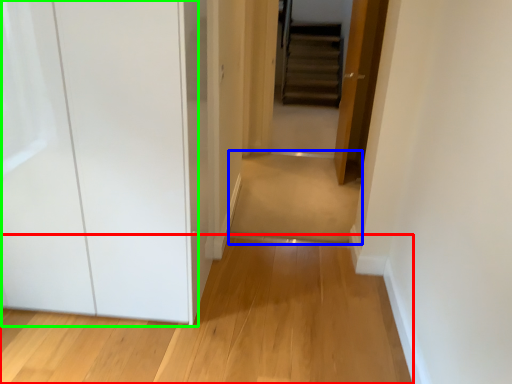
Question: Which object is positioned closest to path (highlighted by a red box)? Select from path (highlighted by a blue box) and glass door (highlighted by a green box).

Choices:
 (A) path
 (B) glass door

Answer: (B)